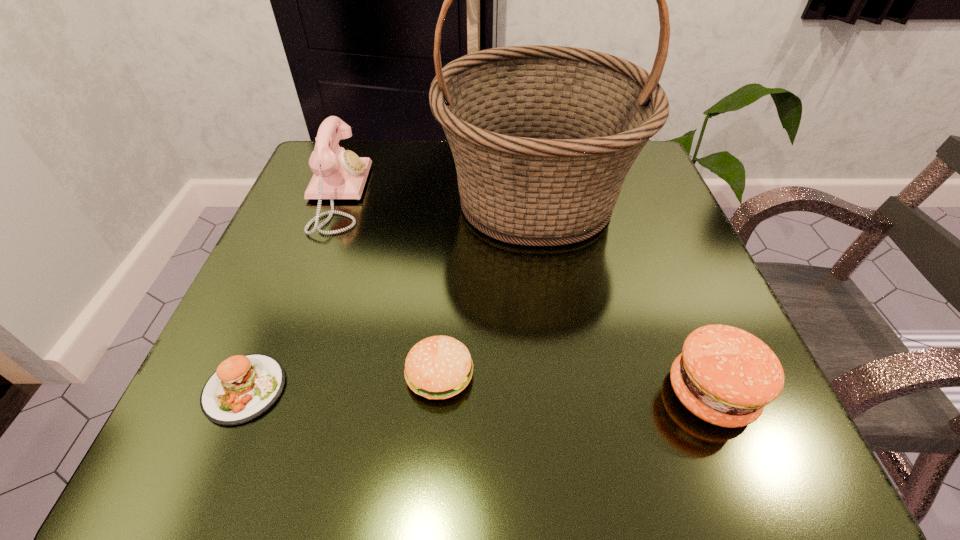
The image size is (960, 540). I want to click on vacant space that's between the second patty from right to left and the second tallest object, so click(x=388, y=285).

Where is `vacant point located between the basket and the tallest patty`? The image size is (960, 540). vacant point located between the basket and the tallest patty is located at coordinates (623, 296).

This screenshot has width=960, height=540. Find the location of `vacant space in between the second tallest object and the second patty from right to left`. vacant space in between the second tallest object and the second patty from right to left is located at coordinates (388, 285).

Locate an element on the screen. This screenshot has height=540, width=960. free space between the tallest object and the telephone is located at coordinates (436, 197).

Locate an element on the screen. The width and height of the screenshot is (960, 540). vacant area between the leftmost patty and the tallest patty is located at coordinates (x=478, y=391).

What are the coordinates of `vacant point located between the telephone and the basket` in the screenshot? It's located at (436, 197).

The image size is (960, 540). In order to click on vacant area between the leftmost patty and the second tallest patty in this screenshot , I will do `click(343, 381)`.

Where is `object that ranks as the third closest to the telephone`? The width and height of the screenshot is (960, 540). object that ranks as the third closest to the telephone is located at coordinates (438, 367).

You are a GUI agent. You are given a task and a screenshot of the screen. Output one action in this format:
    pyautogui.click(x=<x>, y=<y>)
    Task: Click on the object that stands as the third closest to the leftmost patty
    The height and width of the screenshot is (540, 960).
    Given the screenshot: What is the action you would take?
    pyautogui.click(x=338, y=174)

Locate an element on the screen. The width and height of the screenshot is (960, 540). patty object that ranks as the closest to the rightmost patty is located at coordinates (438, 367).